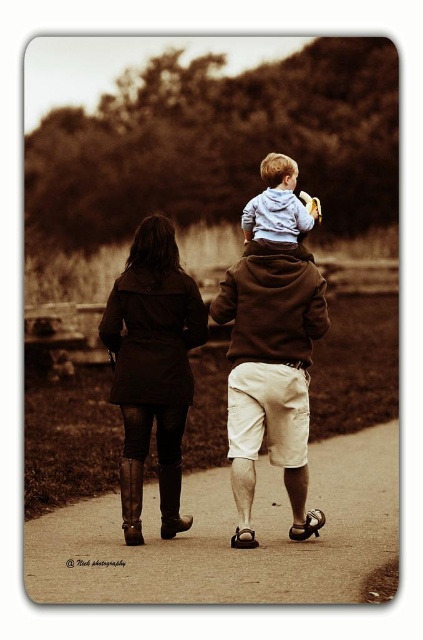
Can you confirm if matte brown hoodie at center is thinner than dark brown leather coat at center?

Yes, matte brown hoodie at center is thinner than dark brown leather coat at center.

Which is more to the left, matte brown hoodie at center or dark brown leather coat at center?

From the viewer's perspective, dark brown leather coat at center appears more on the left side.

Does point (290, 365) lie behind point (153, 330)?

No.

Where is `matte brown hoodie at center`? The width and height of the screenshot is (423, 640). matte brown hoodie at center is located at coordinates (271, 371).

Can you confirm if smooth asphalt path at center is taller than matte brown hoodie at center?

No, smooth asphalt path at center is not taller than matte brown hoodie at center.

Is smooth asphalt path at center thinner than matte brown hoodie at center?

In fact, smooth asphalt path at center might be wider than matte brown hoodie at center.

Is point (342, 596) closer to viewer compared to point (288, 472)?

Yes.

Where is `smooth asphalt path at center`? The height and width of the screenshot is (640, 423). smooth asphalt path at center is located at coordinates (230, 536).

Which is behind, point (282, 548) or point (161, 248)?

Point (161, 248)

Who is taller, smooth asphalt path at center or dark brown leather coat at center?

dark brown leather coat at center

Is point (241, 600) farther from viewer compared to point (183, 348)?

No, it is not.

Find the location of a particular element. smooth asphalt path at center is located at coordinates (230, 536).